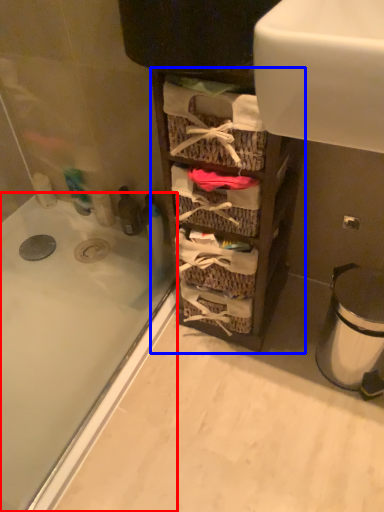
Question: Which point is further to the camera, bathtub (highlighted by a red box) or cabinetry (highlighted by a blue box)?

Choices:
 (A) bathtub
 (B) cabinetry

Answer: (A)